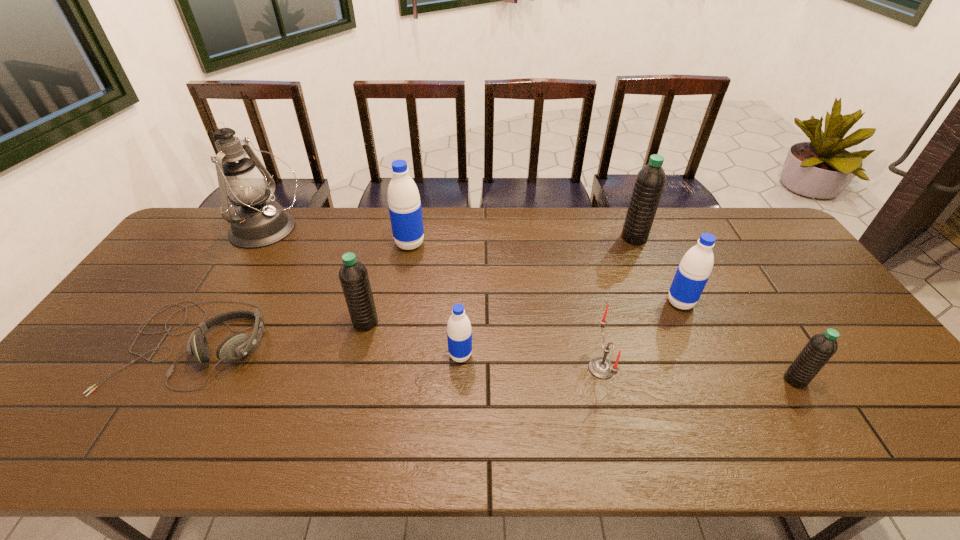
Identify the location of the rightmost object. The width and height of the screenshot is (960, 540). (821, 347).

Identify the location of the nearest blue water bottle. This screenshot has height=540, width=960. (459, 334).

Identify the location of the second nearest water bottle. The image size is (960, 540). (459, 334).

You are a GUI agent. You are given a task and a screenshot of the screen. Output one action in this format:
    pyautogui.click(x=<x>, y=<y>)
    Task: Click on the candle
    
    Given the screenshot: What is the action you would take?
    pyautogui.click(x=600, y=367)

Identify the location of red candle. The height and width of the screenshot is (540, 960). point(600,367).

Identify the location of headset. This screenshot has height=540, width=960. (234, 347).

Locate an element on the screen. This screenshot has width=960, height=540. free region located on the right of the oil lamp is located at coordinates (359, 230).

Identify the location of vacant space located on the right of the leftmost blue water bottle. (443, 244).

Find the location of a particular element. vacant area situated on the front of the farthest black water bottle is located at coordinates (651, 278).

This screenshot has width=960, height=540. I want to click on free space located 0.150m on the left of the second nearest black water bottle, so click(299, 322).